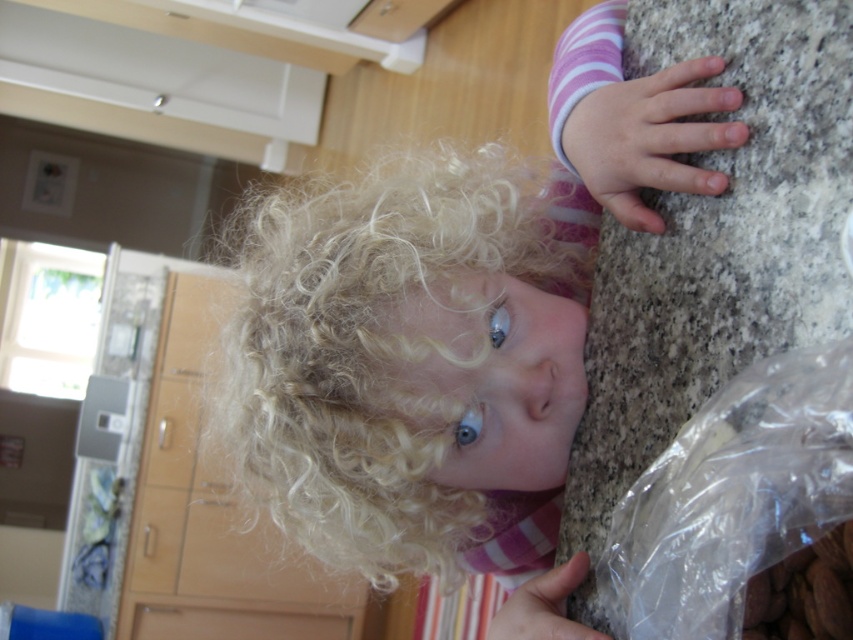
Question: Observing the image, what is the correct spatial positioning of blonde curly hair at upper center in reference to transparent plastic bag at right?

Choices:
 (A) left
 (B) right

Answer: (A)

Question: Which of the following is the farthest from the observer?

Choices:
 (A) (701, 524)
 (B) (260, 308)

Answer: (B)

Question: Can you confirm if blonde curly hair at upper center is smaller than transparent plastic bag at right?

Choices:
 (A) yes
 (B) no

Answer: (B)

Question: Is blonde curly hair at upper center in front of transparent plastic bag at right?

Choices:
 (A) yes
 (B) no

Answer: (B)